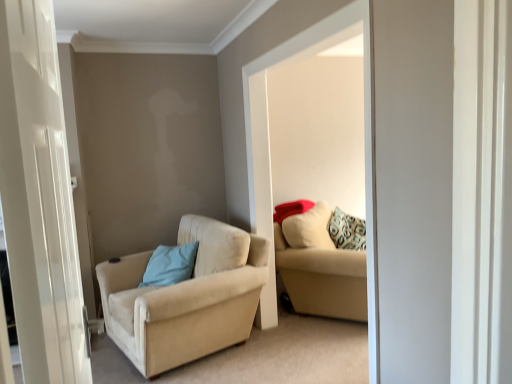
Question: Can you confirm if beige fabric couch at center is bigger than light blue fabric pillow at center-left?

Choices:
 (A) no
 (B) yes

Answer: (B)

Question: Does beige fabric couch at center have a greater width compared to light blue fabric pillow at center-left?

Choices:
 (A) yes
 (B) no

Answer: (A)

Question: Is beige fabric couch at center positioned behind light blue fabric pillow at center-left?

Choices:
 (A) yes
 (B) no

Answer: (B)

Question: Is beige fabric couch at center oriented towards light blue fabric pillow at center-left?

Choices:
 (A) yes
 (B) no

Answer: (B)

Question: Considering the relative positions of beige fabric couch at center and light blue fabric pillow at center-left in the image provided, is beige fabric couch at center to the right of light blue fabric pillow at center-left from the viewer's perspective?

Choices:
 (A) no
 (B) yes

Answer: (B)

Question: Could light blue fabric pillow at center-left be considered to be inside beige fabric couch at center?

Choices:
 (A) yes
 (B) no

Answer: (B)

Question: From the image's perspective, is white glossy door at left under light blue fabric pillow at center-left?

Choices:
 (A) yes
 (B) no

Answer: (B)

Question: Is white glossy door at left behind light blue fabric pillow at center-left?

Choices:
 (A) yes
 (B) no

Answer: (B)

Question: From a real-world perspective, is white glossy door at left on top of light blue fabric pillow at center-left?

Choices:
 (A) no
 (B) yes

Answer: (B)

Question: Considering the relative positions of white glossy door at left and light blue fabric pillow at center-left in the image provided, is white glossy door at left to the left of light blue fabric pillow at center-left from the viewer's perspective?

Choices:
 (A) no
 (B) yes

Answer: (A)

Question: From a real-world perspective, is white glossy door at left positioned under light blue fabric pillow at center-left based on gravity?

Choices:
 (A) no
 (B) yes

Answer: (A)

Question: Could light blue fabric pillow at center-left be considered to be inside white glossy door at left?

Choices:
 (A) yes
 (B) no

Answer: (B)

Question: Is beige fabric couch at center surrounded by beige fabric couch at center?

Choices:
 (A) yes
 (B) no

Answer: (B)